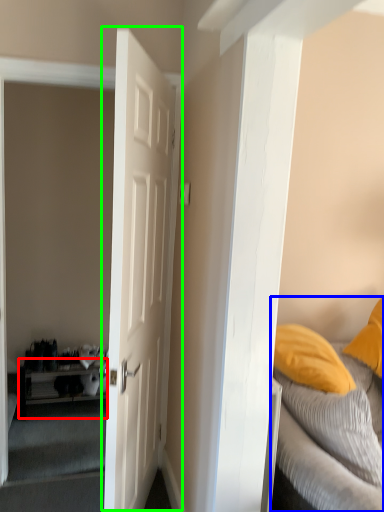
Question: Based on their relative distances, which object is nearer to table (highlighted by a red box)? Choose from bed (highlighted by a blue box) and door (highlighted by a green box).

Choices:
 (A) bed
 (B) door

Answer: (B)